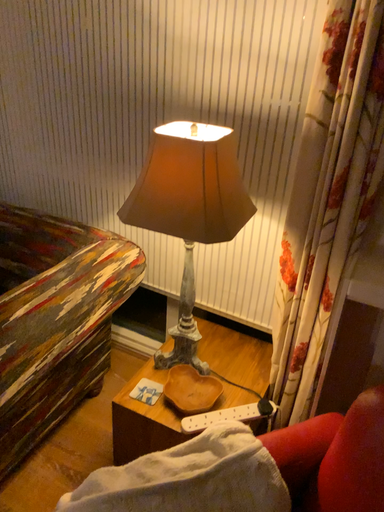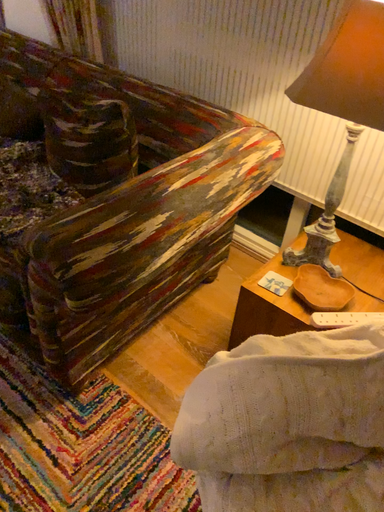
Question: How did the camera likely rotate when shooting the video?

Choices:
 (A) rotated right
 (B) rotated left

Answer: (B)